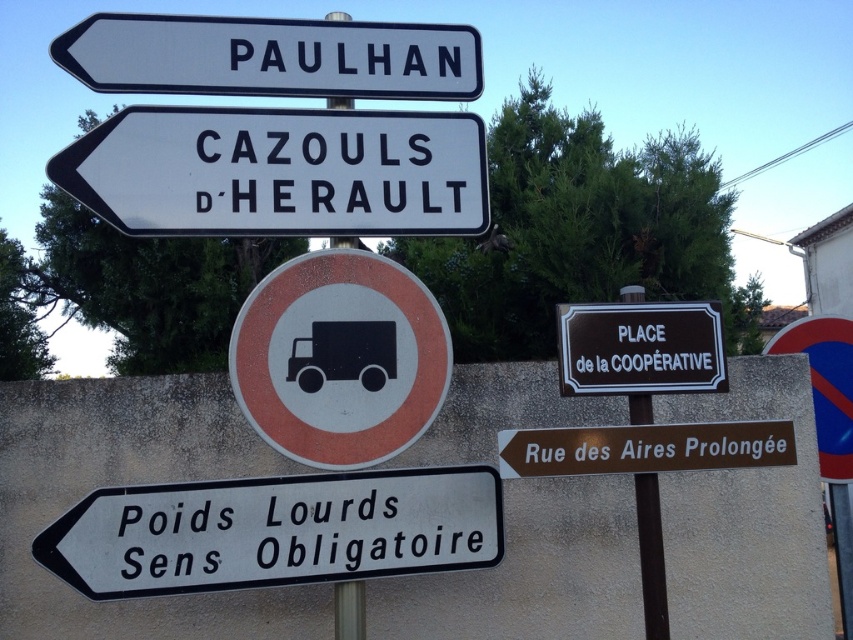
You are standing 2 meters away from the pole with road signs. You want to check the white plastic sign at lower left. Can you reach it without moving closer?

The white plastic sign at lower left is 2.77 meters away from you. Since you are only 2 meters away from the pole, you cannot reach it without moving closer because it is farther than your current position.